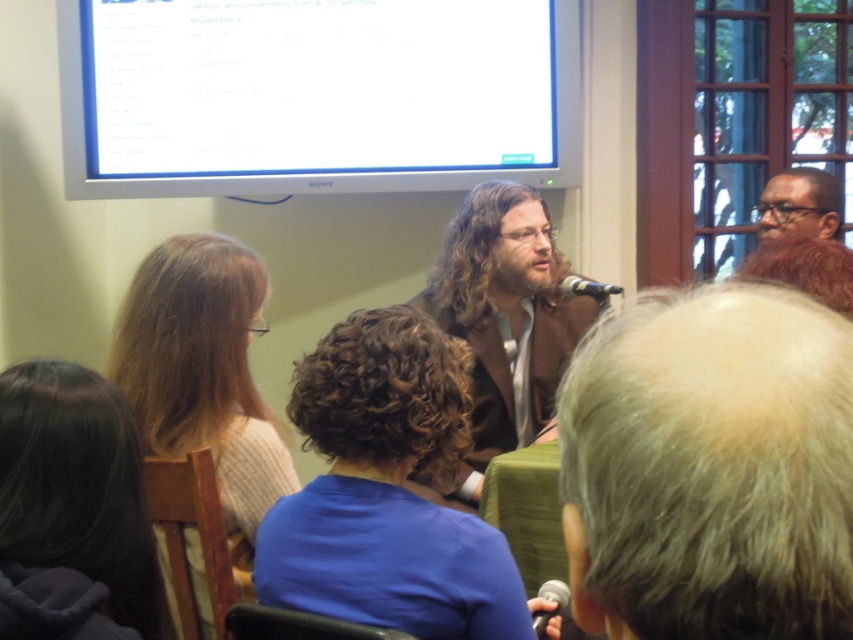
Looking at this image, you are a photographer trying to capture a closeup of the speaker during the presentation. You are currently positioned at the camera location. The speaker is located at point (577,355). What is the minimum focal length required to frame the speaker properly?

The point (577,355) is 28.16 inches away from the camera. To frame the speaker properly, the minimum focal length required would be determined by the sensor size and field of view needed. However, without specific sensor dimensions, we can state that the speaker is 28.16 inches away from the camera, so a focal length that allows capturing that distance effectively would be necessary.

You are attending a presentation and need to point out two specific locations on the screen. The first location is at point (41, 412) and the second is at point (811, 193). From the audience perspective, which point is closer to the front of the screen?

Point (41, 412) is in front of point (811, 193), so from the audience perspective, point (41, 412) is closer to the front of the screen.

You are a photographer trying to capture a closeup of both the dark brown hair at lower left and the matte black beard at upper right in the scene. Given that your camera has a maximum focus range of 7 feet, will you be able to include both subjects in the same frame without moving the camera?

The dark brown hair at lower left and the matte black beard at upper right are 7.10 feet apart from each other. Since the camera can only focus up to 7 feet, the distance between them exceeds the maximum focus range. Therefore, you cannot capture both subjects in the same frame without moving the camera.